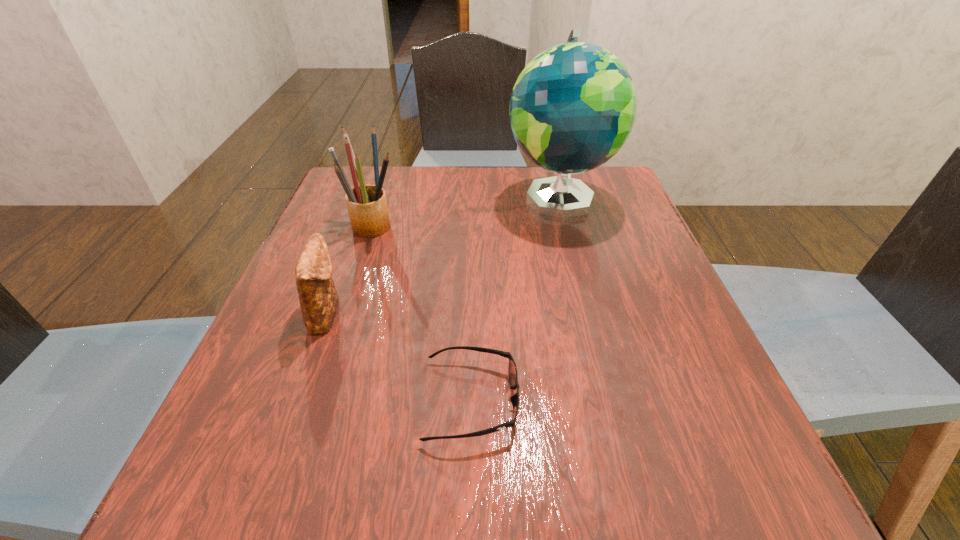
At what (x,y) coordinates should I click in order to perform the action: click on free space between the globe and the third shortest object. Please return your answer as a coordinate pair (x, y). Looking at the image, I should click on (467, 211).

What are the coordinates of `free space between the second nearest object and the second object from right to left` in the screenshot? It's located at (399, 356).

Where is `object that stands as the closest to the clutch bag`? This screenshot has width=960, height=540. object that stands as the closest to the clutch bag is located at coordinates (367, 206).

Image resolution: width=960 pixels, height=540 pixels. Identify the location of the third closest object to the third tallest object. (572, 108).

Find the location of `free space in the image that satisfies the following two spatial constraints: 1. on the front surface of the rightmost object; 2. on the front-facing side of the shortest object`. free space in the image that satisfies the following two spatial constraints: 1. on the front surface of the rightmost object; 2. on the front-facing side of the shortest object is located at coordinates (612, 400).

What are the coordinates of `free location that satisfies the following two spatial constraints: 1. on the front surface of the rightmost object; 2. on the front-facing side of the sunglasses` in the screenshot? It's located at (612, 400).

Find the location of a particular element. free space that satisfies the following two spatial constraints: 1. on the front surface of the globe; 2. on the open side of the second nearest object is located at coordinates (588, 313).

What are the coordinates of `vacant region that satisfies the following two spatial constraints: 1. on the front surface of the rightmost object; 2. on the front-facing side of the third object from left to right` in the screenshot? It's located at (612, 400).

Find the location of a particular element. The height and width of the screenshot is (540, 960). free spot that satisfies the following two spatial constraints: 1. on the front surface of the rightmost object; 2. on the open side of the third farthest object is located at coordinates (588, 313).

The height and width of the screenshot is (540, 960). What are the coordinates of `vacant point that satisfies the following two spatial constraints: 1. on the front surface of the rightmost object; 2. on the open side of the third tallest object` in the screenshot? It's located at (588, 313).